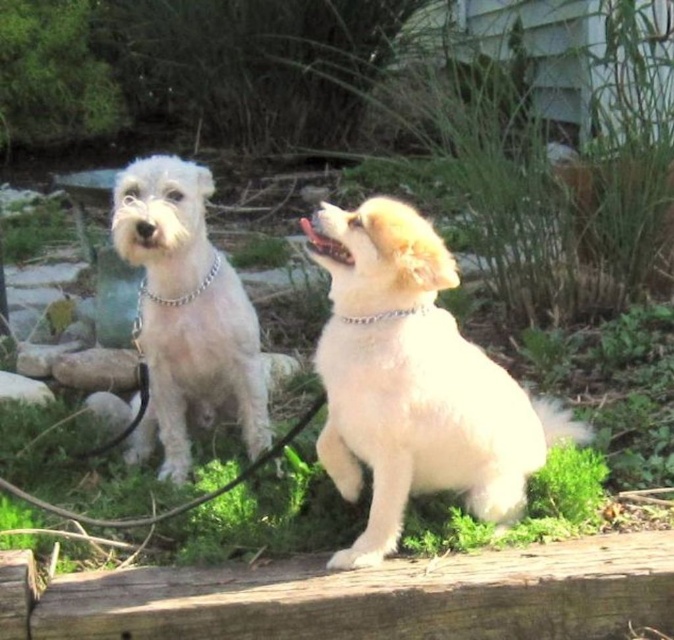
You are a dog owner trying to decide which item to pick up first. You see the fluffy white dog at center and the silver metallic chain at upper center. Which one is bigger?

The fluffy white dog at center is larger in size than the silver metallic chain at upper center, so you should pick up the fluffy white dog at center first.

You are a dog owner who wants to ensure your fluffy white dog at center stays safe while tied to the silver metallic chain at upper center. Based on their positions in the image, can you tell if the chain is above or below the dog?

The fluffy white dog at center is positioned under the silver metallic chain at upper center, so the chain is above the dog.